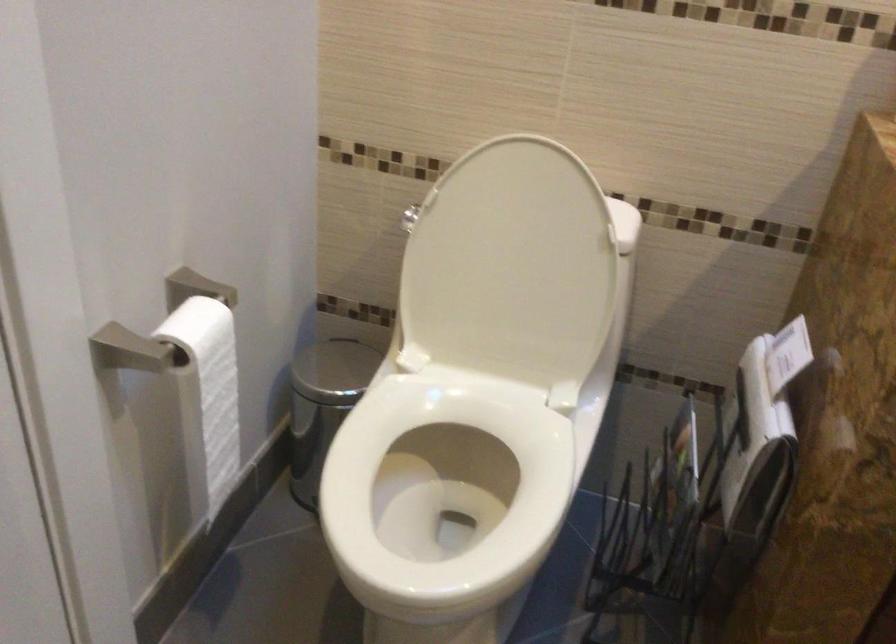
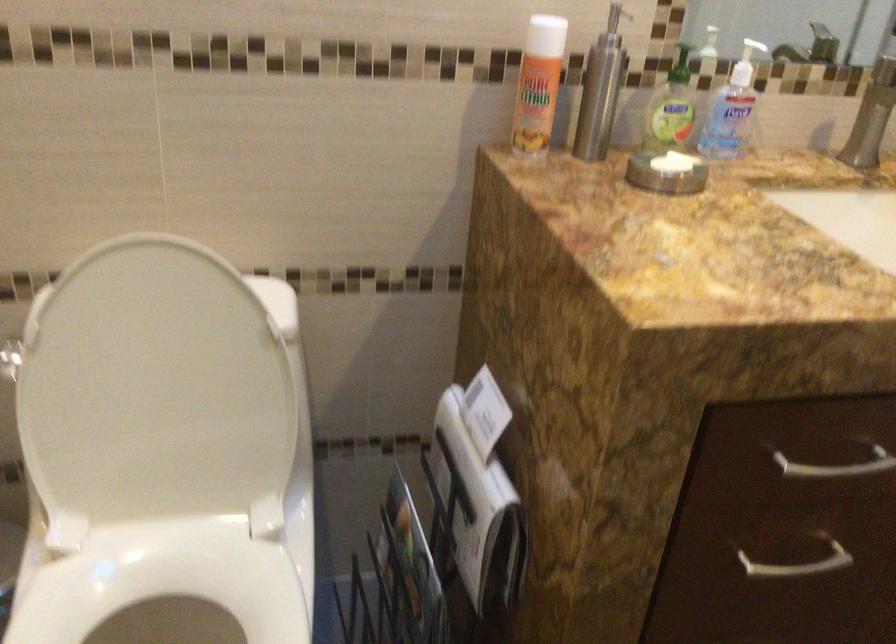
Locate, in the second image, the point that corresponds to (504,263) in the first image.

(152, 391)